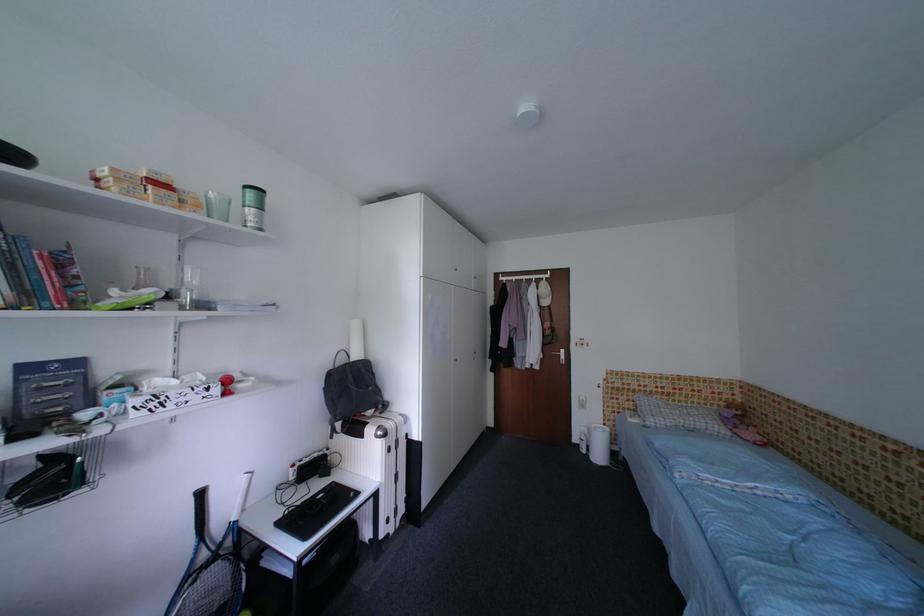
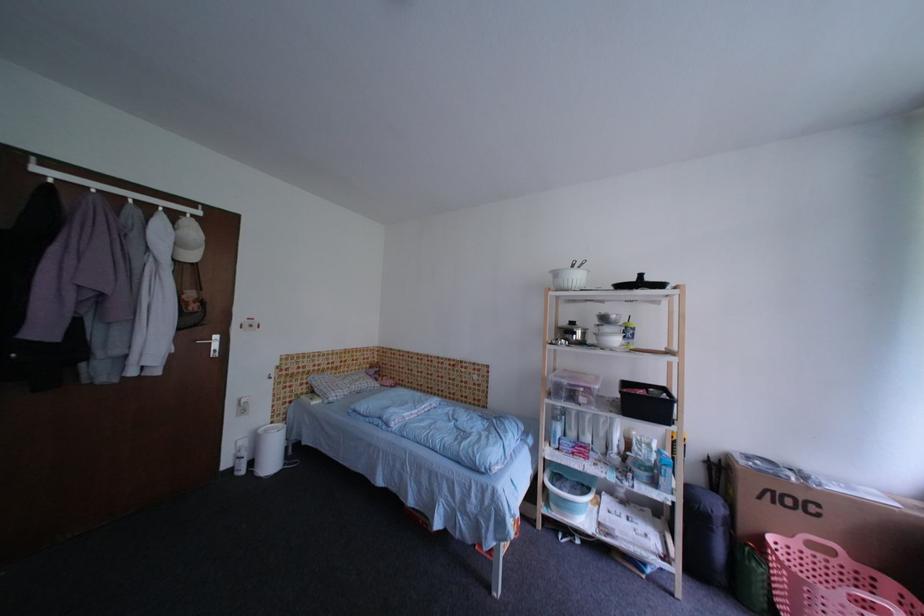
Question: The camera is either moving clockwise (left) or counter-clockwise (right) around the object. The first image is from the beginning of the video and the second image is from the end. Is the camera moving left or right when shooting the video?

Choices:
 (A) Left
 (B) Right

Answer: (A)